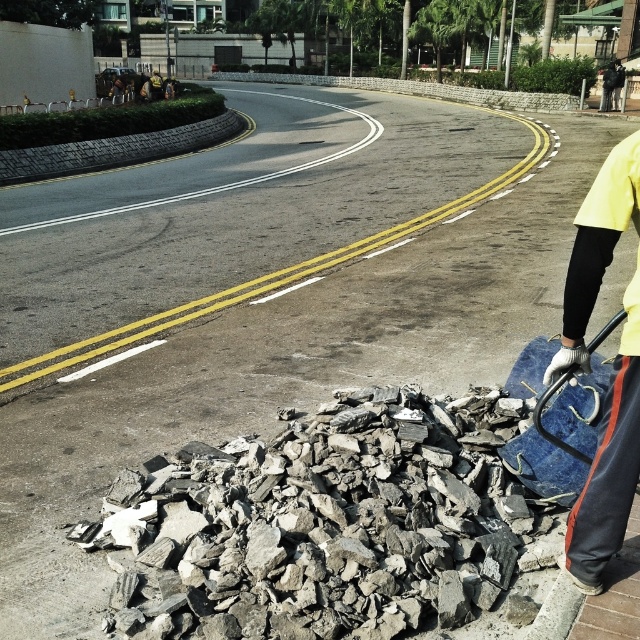
Is gray rough rocks at lower center bigger than yellow fabric at right?

Yes, gray rough rocks at lower center is bigger than yellow fabric at right.

Is gray rough rocks at lower center to the right of yellow fabric at right from the viewer's perspective?

Incorrect, gray rough rocks at lower center is not on the right side of yellow fabric at right.

Which is in front, point (307, 602) or point (586, 284)?

Point (586, 284) is more forward.

At what (x,y) coordinates should I click in order to perform the action: click on gray rough rocks at lower center. Please return your answer as a coordinate pair (x, y). This screenshot has height=640, width=640. Looking at the image, I should click on (321, 528).